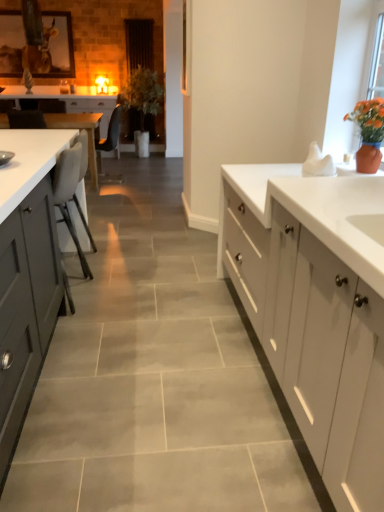
Question: Are matte gray chair at center, which ranks as the second chair in front-to-back order, and beige fabric chair at left, the second chair in the back-to-front sequence, located far from each other?

Choices:
 (A) no
 (B) yes

Answer: (B)

Question: Does matte gray chair at center, which ranks as the second chair in front-to-back order, appear on the right side of beige fabric chair at left, positioned as the 2th chair in top-to-bottom order?

Choices:
 (A) no
 (B) yes

Answer: (A)

Question: Considering the relative sizes of matte gray chair at center, placed as the second chair when sorted from bottom to top, and beige fabric chair at left, positioned as the 2th chair in top-to-bottom order, in the image provided, is matte gray chair at center, placed as the second chair when sorted from bottom to top, taller than beige fabric chair at left, positioned as the 2th chair in top-to-bottom order,?

Choices:
 (A) yes
 (B) no

Answer: (B)

Question: From the image's perspective, would you say matte gray chair at center, which ranks as the 1th chair in back-to-front order, is shown under beige fabric chair at left, the second chair in the back-to-front sequence?

Choices:
 (A) yes
 (B) no

Answer: (B)

Question: Is matte gray chair at center, marked as the first chair in a top-to-bottom arrangement, closer to camera compared to beige fabric chair at left, the second chair in the back-to-front sequence?

Choices:
 (A) yes
 (B) no

Answer: (B)

Question: Does matte gray chair at center, which ranks as the second chair in front-to-back order, have a lesser height compared to beige fabric chair at left, positioned as the 2th chair in top-to-bottom order?

Choices:
 (A) yes
 (B) no

Answer: (A)

Question: Could beige fabric chair at left, the second chair in the back-to-front sequence, be considered to be inside green matte plant at center?

Choices:
 (A) yes
 (B) no

Answer: (B)

Question: Does green matte plant at center have a lesser height compared to beige fabric chair at left, positioned as the 2th chair in top-to-bottom order?

Choices:
 (A) yes
 (B) no

Answer: (B)

Question: Is green matte plant at center not near beige fabric chair at left, the second chair in the back-to-front sequence?

Choices:
 (A) no
 (B) yes

Answer: (B)

Question: Does green matte plant at center lie behind beige fabric chair at left, the second chair in the back-to-front sequence?

Choices:
 (A) yes
 (B) no

Answer: (A)

Question: Is green matte plant at center touching beige fabric chair at left, positioned as the 2th chair in top-to-bottom order?

Choices:
 (A) no
 (B) yes

Answer: (A)

Question: From the image's perspective, is green matte plant at center over beige fabric chair at left, the second chair in the back-to-front sequence?

Choices:
 (A) no
 (B) yes

Answer: (B)

Question: Is matte gray cabinets at left, arranged as the 2th cabinetry when viewed from the top, completely or partially inside white glossy table at left?

Choices:
 (A) no
 (B) yes

Answer: (A)